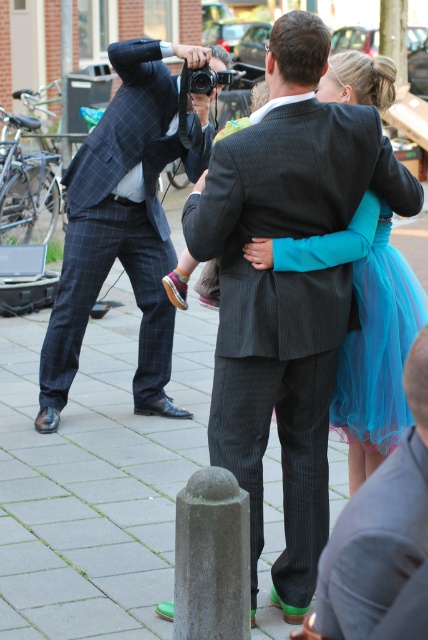
Is point (273, 209) positioned in front of point (351, 460)?

Yes, point (273, 209) is in front of point (351, 460).

Between point (291, 136) and point (336, 83), which one is positioned in front?

Point (291, 136) is in front.

This screenshot has height=640, width=428. What do you see at coordinates (282, 308) in the screenshot?
I see `pinstriped wool suit at center` at bounding box center [282, 308].

Where is `pinstriped wool suit at center`? pinstriped wool suit at center is located at coordinates pos(282,308).

Is pinstriped wool suit at center taller than matte black camera at upper center?

Correct, pinstriped wool suit at center is much taller as matte black camera at upper center.

Is pinstriped wool suit at center to the left of matte black camera at upper center from the viewer's perspective?

No, pinstriped wool suit at center is not to the left of matte black camera at upper center.

Between point (253, 342) and point (187, 268), which one is positioned in front?

Positioned in front is point (253, 342).

In order to click on pinstriped wool suit at center in this screenshot , I will do `click(282, 308)`.

From the picture: Does pinstriped wool suit at center appear on the right side of dark gray pinstripe suit at center?

In fact, pinstriped wool suit at center is to the left of dark gray pinstripe suit at center.

Measure the distance between point (309,534) and camera.

4.36 meters

Between point (226, 188) and point (386, 540), which one is positioned in front?

Point (386, 540)

Where is `pinstriped wool suit at center`? pinstriped wool suit at center is located at coordinates (282, 308).